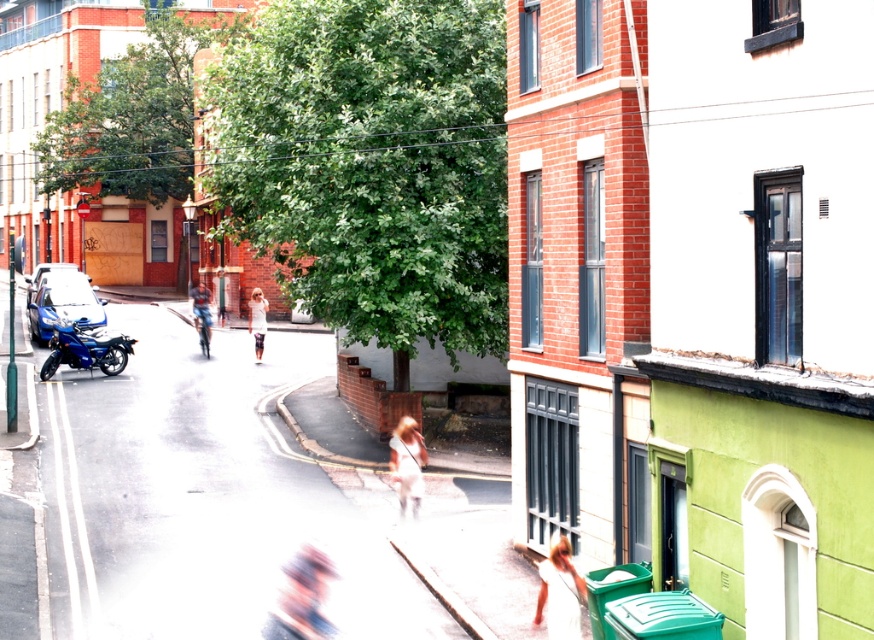
You are a pedestrian standing on the white concrete pavement at center. You want to move to the light beige pants at center. Which direction should you move to reach them?

The white concrete pavement at center is positioned on the left side of light beige pants at center, so you should move to the right to reach them.